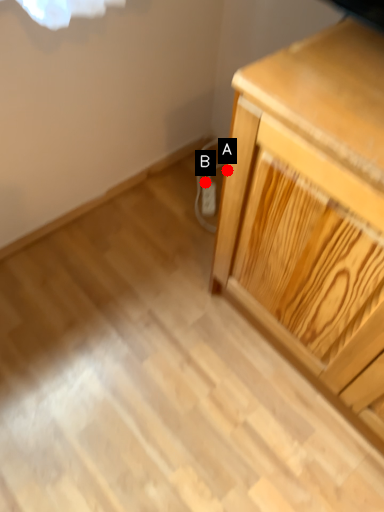
Question: Two points are circled on the image, labeled by A and B beside each circle. Which point appears farthest from the camera in this image?

Choices:
 (A) A is further
 (B) B is further

Answer: (B)